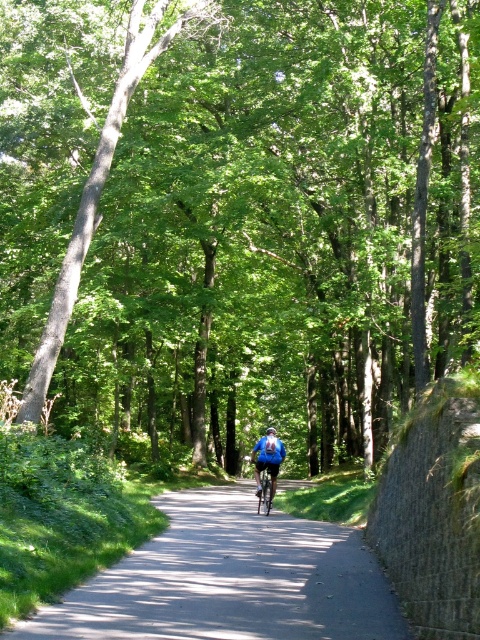
You are a cyclist planning to ride through the forest path shown. You notice the green leafy tree at center and the blue matte helmet at center. Which object is positioned higher relative to the cyclist?

The green leafy tree at center is located above the blue matte helmet at center, so the green leafy tree at center is higher relative to the cyclist.

You are a cyclist planning to ride through the forest path shown in the image. You notice the green leafy tree at center. Based on its position coordinates, can you estimate whether it is located in the upper half or lower half of the image?

The green leafy tree at center is located at point coordinates of (x=238, y=218). Since the y coordinate is 0.496, which is just below 0.5, it is positioned slightly in the lower half of the image.

You are a photographer aiming to capture the cyclist in the forest. You want to ensure both the blue fabric jacket at center and the blue matte helmet at center are clearly visible in your shot. Which object should you focus on first to ensure proper focus, considering their sizes?

The blue fabric jacket at center is taller than the blue matte helmet at center, so focusing on the blue fabric jacket at center first would ensure proper focus since it is larger and more prominent in the frame.